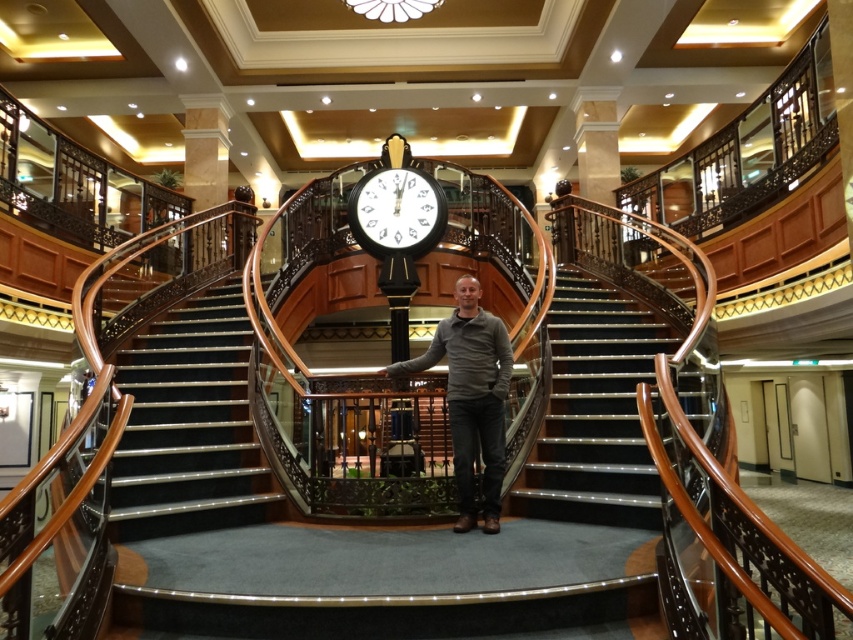
Is point (131, 344) in front of point (608, 195)?

Yes, point (131, 344) is in front of point (608, 195).

You are a GUI agent. You are given a task and a screenshot of the screen. Output one action in this format:
    pyautogui.click(x=<x>, y=<y>)
    Task: Click on the polished wood stairs at center
    Image resolution: width=853 pixels, height=640 pixels.
    Given the screenshot: What is the action you would take?
    189,424

Between point (604, 196) and point (222, 112), which one is positioned in front?

Point (604, 196) is more forward.

Which is above, white marble pillar at upper center or marble column at upper center?

marble column at upper center

Is point (598, 232) in front of point (194, 112)?

Yes.

Where is `white marble pillar at upper center`? white marble pillar at upper center is located at coordinates (596, 148).

Is the position of polished wood stairs at center more distant than that of black glossy clock at center?

No, it is not.

Who is positioned more to the right, polished wood stairs at center or black glossy clock at center?

From the viewer's perspective, black glossy clock at center appears more on the right side.

Image resolution: width=853 pixels, height=640 pixels. Find the location of `polished wood stairs at center`. polished wood stairs at center is located at coordinates (189, 424).

Where is `polished wood stairs at center`? polished wood stairs at center is located at coordinates (189, 424).